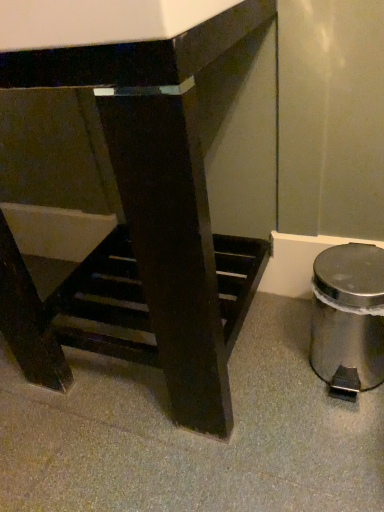
Where is `blank space situated above polished stainless steel trash can at lower right (from a real-world perspective)`? This screenshot has width=384, height=512. blank space situated above polished stainless steel trash can at lower right (from a real-world perspective) is located at coordinates (356, 271).